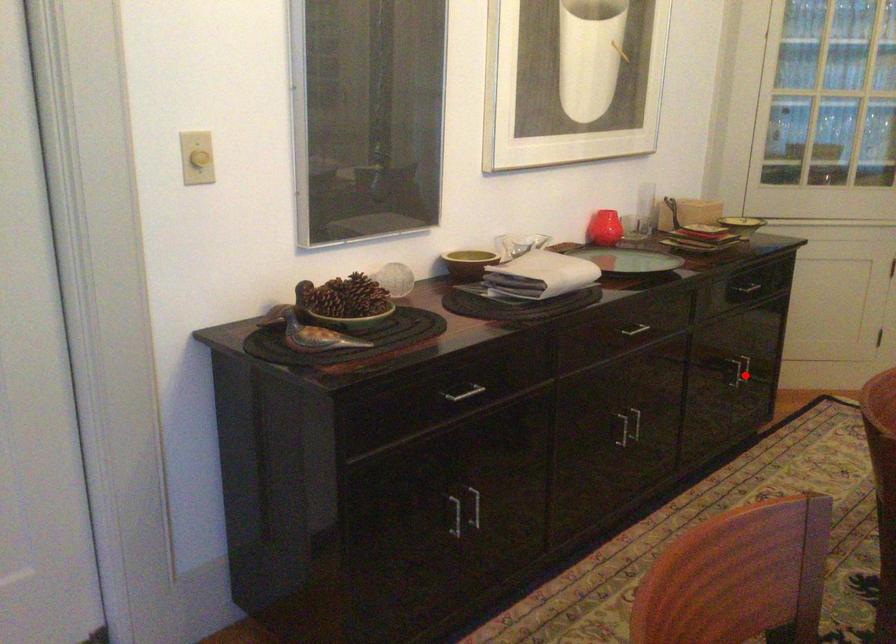
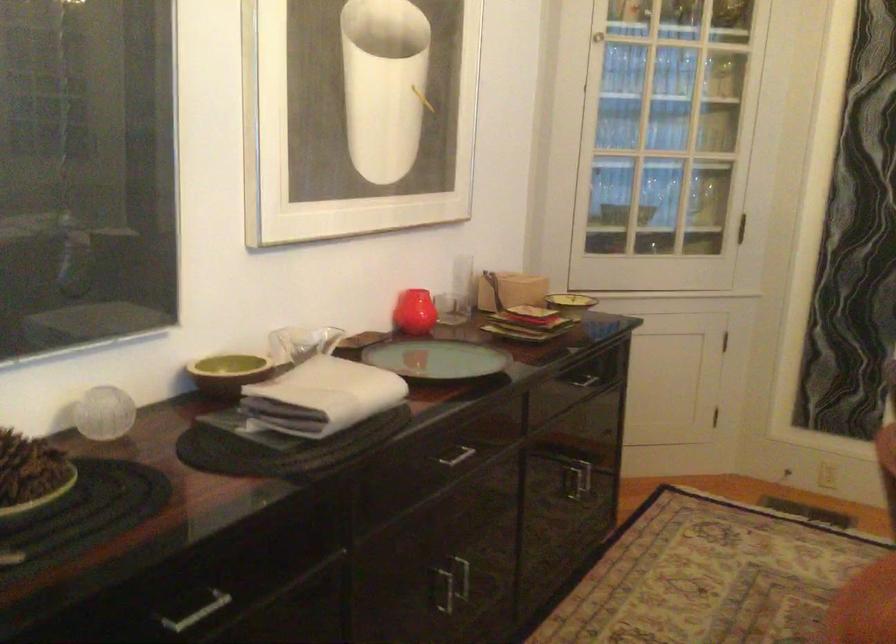
Where in the second image is the point corresponding to the highlighted location from the first image?

(574, 483)